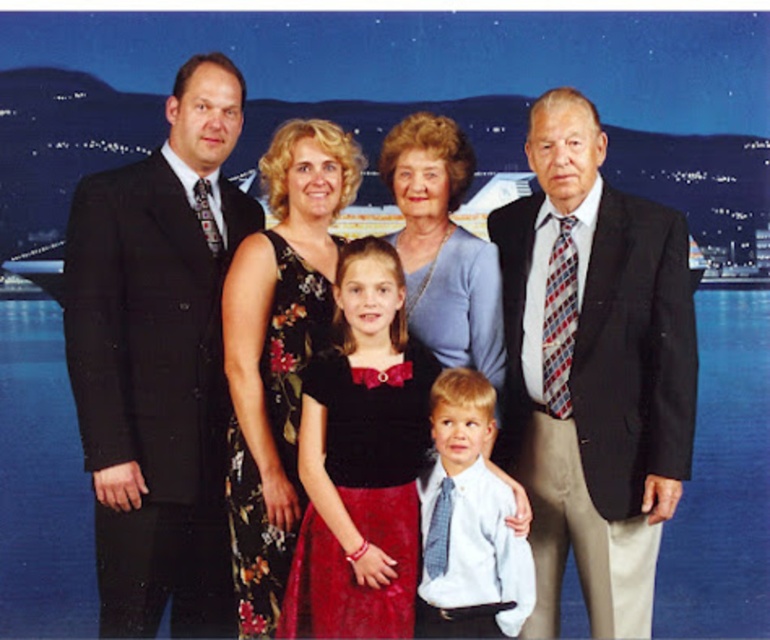
Question: Based on their relative distances, which object is farther from the light blue shirt and tie at center?

Choices:
 (A) matte black suit at left
 (B) velvet black dress at center

Answer: (A)

Question: Observing the image, what is the correct spatial positioning of matte black suit at left in reference to floral dress at center?

Choices:
 (A) below
 (B) above

Answer: (B)

Question: Which point is farther from the camera taking this photo?

Choices:
 (A) (469, 332)
 (B) (504, 496)
 (C) (424, 397)
 (D) (129, 404)

Answer: (A)

Question: Which point is closer to the camera taking this photo?

Choices:
 (A) (85, 276)
 (B) (300, 224)

Answer: (A)

Question: From the image, what is the correct spatial relationship of velvet black dress at center in relation to floral dress at center?

Choices:
 (A) right
 (B) left

Answer: (A)

Question: Does velvet black dress at center appear over light blue shirt and tie at center?

Choices:
 (A) no
 (B) yes

Answer: (B)